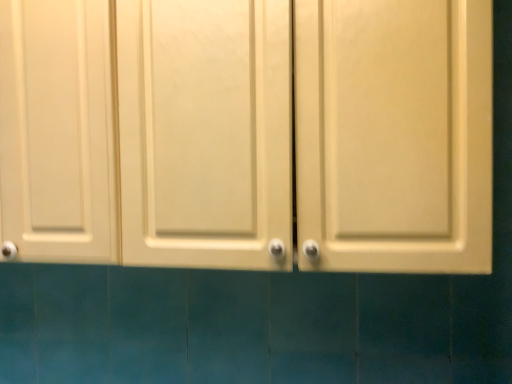
Find the location of a particular element. matte cream cupboard at center is located at coordinates (147, 132).

In order to face matte cream cupboard at center, should I rotate leftwards or rightwards?

You should rotate left by 7.514 degrees.

What do you see at coordinates (147, 132) in the screenshot?
I see `matte cream cupboard at center` at bounding box center [147, 132].

In the scene shown: Measure the distance between matte cream cupboard at center and camera.

The depth of matte cream cupboard at center is 32.85 inches.

Find the location of a particular element. Image resolution: width=512 pixels, height=384 pixels. matte cream cupboard at center is located at coordinates (147, 132).